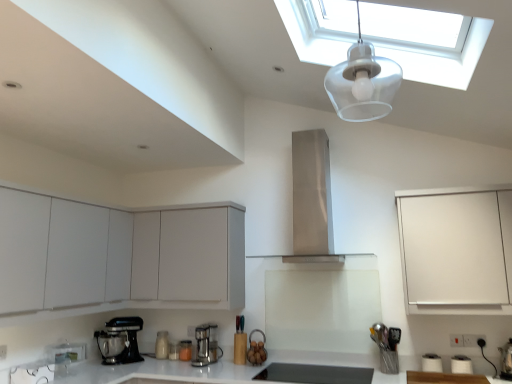
Question: Is white matte cabinet at right, which is counted as the third cabinetry, starting from the left, thinner than transparent plastic light fixture at upper center?

Choices:
 (A) yes
 (B) no

Answer: (B)

Question: Is transparent plastic light fixture at upper center at the back of white matte cabinet at right, arranged as the 1th cabinetry when viewed from the right?

Choices:
 (A) yes
 (B) no

Answer: (B)

Question: Is white matte cabinet at right, arranged as the 1th cabinetry when viewed from the right, shorter than transparent plastic light fixture at upper center?

Choices:
 (A) yes
 (B) no

Answer: (B)

Question: Could you tell me if white matte cabinet at right, arranged as the 1th cabinetry when viewed from the right, is turned towards transparent plastic light fixture at upper center?

Choices:
 (A) yes
 (B) no

Answer: (A)

Question: Is transparent plastic light fixture at upper center a part of white matte cabinet at right, which is counted as the third cabinetry, starting from the left?

Choices:
 (A) no
 (B) yes

Answer: (A)

Question: In terms of height, does matte black mixer at lower left, which is counted as the 1th kitchen appliance, starting from the left, look taller or shorter compared to matte white blender at center, acting as the 2th kitchen appliance starting from the left?

Choices:
 (A) short
 (B) tall

Answer: (B)

Question: Is point (131, 350) closer or farther from the camera than point (164, 340)?

Choices:
 (A) closer
 (B) farther

Answer: (A)

Question: From a real-world perspective, relative to matte white blender at center, the third kitchen appliance from the right, is matte black mixer at lower left, which appears as the 4th kitchen appliance when viewed from the right, vertically above or below?

Choices:
 (A) below
 (B) above

Answer: (B)

Question: Looking at their shapes, would you say matte black mixer at lower left, which is counted as the 1th kitchen appliance, starting from the left, is wider or thinner than matte white blender at center, acting as the 2th kitchen appliance starting from the left?

Choices:
 (A) wide
 (B) thin

Answer: (A)

Question: From a real-world perspective, relative to metallic silver coffee maker at center, the second kitchen appliance positioned from the right, is satin chrome coffee maker at center, the first kitchen appliance viewed from the right, vertically above or below?

Choices:
 (A) above
 (B) below

Answer: (A)

Question: From the image's perspective, is satin chrome coffee maker at center, the first kitchen appliance viewed from the right, located above or below metallic silver coffee maker at center, the second kitchen appliance positioned from the right?

Choices:
 (A) below
 (B) above

Answer: (B)

Question: In terms of width, does satin chrome coffee maker at center, which appears as the fourth kitchen appliance when viewed from the left, look wider or thinner when compared to metallic silver coffee maker at center, marked as the third kitchen appliance in a left-to-right arrangement?

Choices:
 (A) thin
 (B) wide

Answer: (B)

Question: In the image, is satin chrome coffee maker at center, the first kitchen appliance viewed from the right, positioned in front of or behind metallic silver coffee maker at center, the second kitchen appliance positioned from the right?

Choices:
 (A) behind
 (B) front

Answer: (B)

Question: From the image's perspective, relative to transparent glass skylight at upper center, is satin chrome coffee maker at center, which appears as the fourth kitchen appliance when viewed from the left, above or below?

Choices:
 (A) below
 (B) above

Answer: (A)

Question: In terms of size, does satin chrome coffee maker at center, the first kitchen appliance viewed from the right, appear bigger or smaller than transparent glass skylight at upper center?

Choices:
 (A) big
 (B) small

Answer: (B)